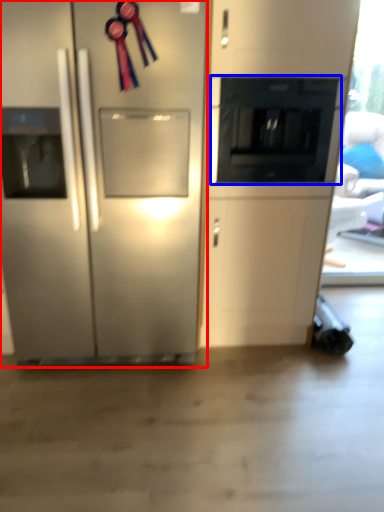
Question: Among these objects, which one is nearest to the camera, refrigerator (highlighted by a red box) or appliance (highlighted by a blue box)?

Choices:
 (A) refrigerator
 (B) appliance

Answer: (A)